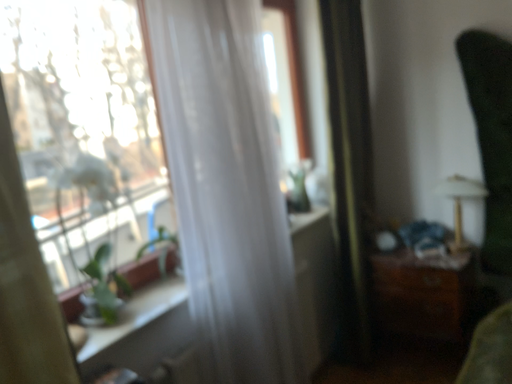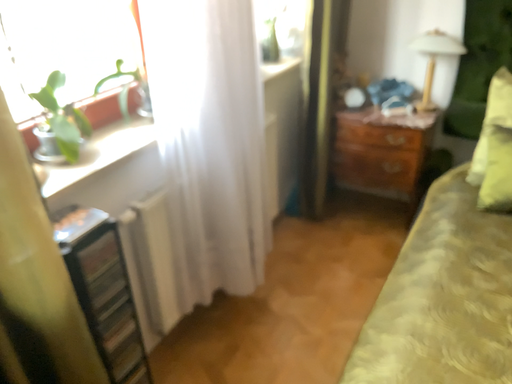
Question: How did the camera likely rotate when shooting the video?

Choices:
 (A) rotated downward
 (B) rotated upward

Answer: (A)